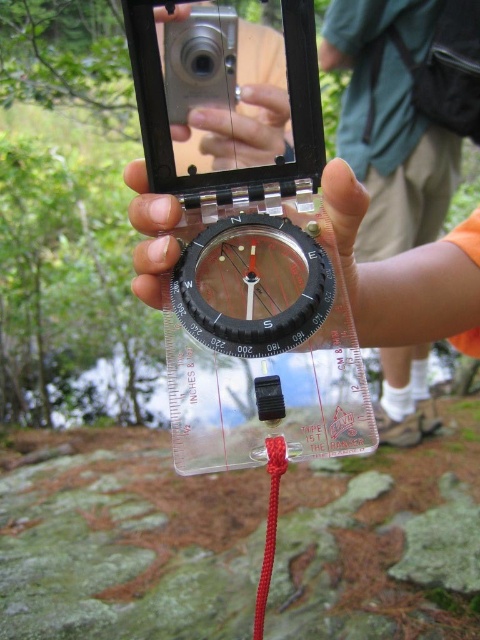
Based on the photo, is silver metallic camera at center smaller than red cord at center?

Correct, silver metallic camera at center occupies less space than red cord at center.

Does silver metallic camera at center have a lesser width compared to red cord at center?

No, silver metallic camera at center is not thinner than red cord at center.

Between point (183, 104) and point (269, 445), which one is positioned in front?

Positioned in front is point (269, 445).

You are a GUI agent. You are given a task and a screenshot of the screen. Output one action in this format:
    pyautogui.click(x=<x>, y=<y>)
    Task: Click on the silver metallic camera at center
    
    Given the screenshot: What is the action you would take?
    pyautogui.click(x=200, y=60)

Between clear plastic compass at center and silver metallic camera at center, which one is positioned lower?

Positioned lower is clear plastic compass at center.

Is clear plastic compass at center to the left of silver metallic camera at center from the viewer's perspective?

In fact, clear plastic compass at center is to the right of silver metallic camera at center.

Does point (323, 198) come in front of point (184, 76)?

No, (323, 198) is further to viewer.

In order to click on clear plastic compass at center in this screenshot , I will do 152,234.

Who is taller, clear plastic compass at center or red cord at center?

clear plastic compass at center is taller.

Where is `clear plastic compass at center`? clear plastic compass at center is located at coordinates (152, 234).

In order to click on clear plastic compass at center in this screenshot , I will do `click(152, 234)`.